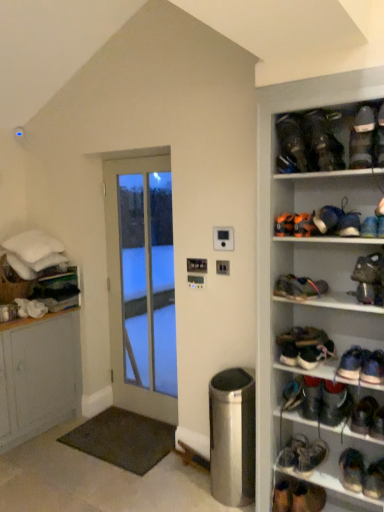
Question: From a real-world perspective, is blue suede shoe at upper right, acting as the 16th footwear starting from the bottom, positioned under dark brown leather shoe at center right, the 10th footwear when ordered from bottom to top, based on gravity?

Choices:
 (A) yes
 (B) no

Answer: (B)

Question: Is blue suede shoe at upper right, acting as the fifth footwear starting from the top, facing away from dark brown leather shoe at center right, the 10th footwear when ordered from bottom to top?

Choices:
 (A) no
 (B) yes

Answer: (A)

Question: Is blue suede shoe at upper right, acting as the 16th footwear starting from the bottom, closer to camera compared to dark brown leather shoe at center right, marked as the 11th footwear in a top-to-bottom arrangement?

Choices:
 (A) yes
 (B) no

Answer: (A)

Question: Is blue suede shoe at upper right, acting as the fifth footwear starting from the top, not near dark brown leather shoe at center right, the 10th footwear when ordered from bottom to top?

Choices:
 (A) no
 (B) yes

Answer: (A)

Question: From the image's perspective, would you say blue suede shoe at upper right, acting as the fifth footwear starting from the top, is shown under dark brown leather shoe at center right, the 10th footwear when ordered from bottom to top?

Choices:
 (A) no
 (B) yes

Answer: (A)

Question: In terms of height, does white glass door at center look taller or shorter compared to multicolored fabric shoe at center right, the ninth footwear when ordered from top to bottom?

Choices:
 (A) short
 (B) tall

Answer: (B)

Question: Visually, is white glass door at center positioned to the left or to the right of multicolored fabric shoe at center right, the ninth footwear when ordered from top to bottom?

Choices:
 (A) left
 (B) right

Answer: (A)

Question: From the image's perspective, is white glass door at center positioned above or below multicolored fabric shoe at center right, which appears as the twelfth footwear when ordered from the bottom?

Choices:
 (A) below
 (B) above

Answer: (A)

Question: Considering the positions of point (132, 286) and point (311, 279), is point (132, 286) closer or farther from the camera than point (311, 279)?

Choices:
 (A) closer
 (B) farther

Answer: (B)

Question: From the image's perspective, is blue suede sneakers at right, which is counted as the twelfth footwear, starting from the top, located above or below dark gray suede shoes at upper right, the nineteenth footwear when ordered from bottom to top?

Choices:
 (A) below
 (B) above

Answer: (A)

Question: Would you say blue suede sneakers at right, which is counted as the twelfth footwear, starting from the top, is to the left or to the right of dark gray suede shoes at upper right, the second footwear from the top, in the picture?

Choices:
 (A) right
 (B) left

Answer: (A)

Question: Considering the positions of blue suede sneakers at right, which appears as the 9th footwear when ordered from the bottom, and dark gray suede shoes at upper right, the second footwear from the top, in the image, is blue suede sneakers at right, which appears as the 9th footwear when ordered from the bottom, bigger or smaller than dark gray suede shoes at upper right, the second footwear from the top,?

Choices:
 (A) small
 (B) big

Answer: (A)

Question: Looking at their shapes, would you say blue suede sneakers at right, which appears as the 9th footwear when ordered from the bottom, is wider or thinner than dark gray suede shoes at upper right, the second footwear from the top?

Choices:
 (A) thin
 (B) wide

Answer: (B)

Question: Relative to blue suede shoe at upper right, acting as the 16th footwear starting from the bottom, is blue suede sneaker at upper right, the fifteenth footwear in the bottom-to-top sequence, in front or behind?

Choices:
 (A) behind
 (B) front

Answer: (B)

Question: From the image's perspective, is blue suede sneaker at upper right, the 6th footwear when ordered from top to bottom, positioned above or below blue suede shoe at upper right, acting as the fifth footwear starting from the top?

Choices:
 (A) below
 (B) above

Answer: (A)